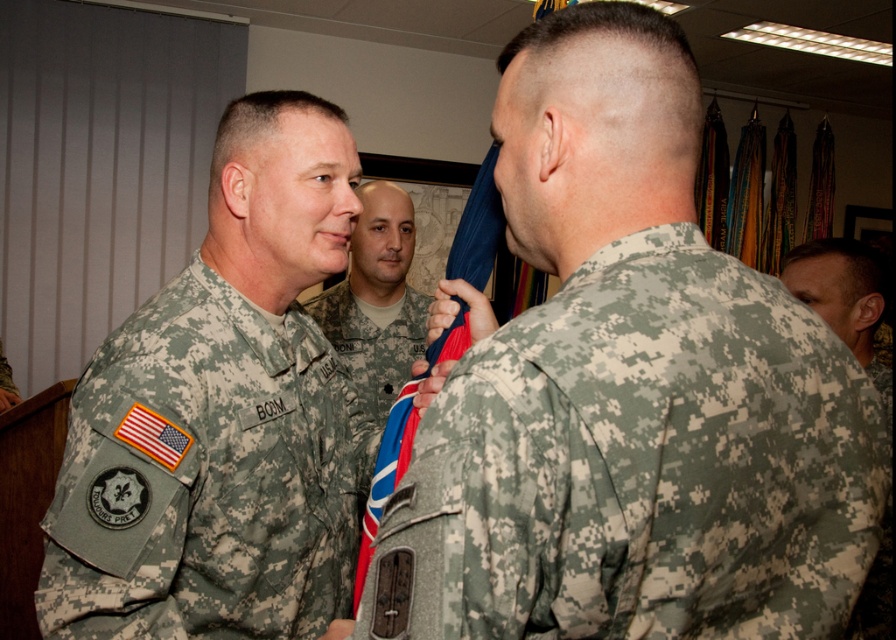
You are observing a military ceremony and notice two soldiers in camouflage uniforms. Which soldier, the camouflage fabric uniform at left or the camouflage uniform at center, is standing more to the left side?

The camouflage fabric uniform at left is positioned on the left side of the camouflage uniform at center, so the camouflage fabric uniform at left is standing more to the left side.

You are observing a military ceremony and notice two soldiers wearing camouflage uniforms. The soldier in the camouflage fabric uniform at left and the soldier in the camouflage uniform at center. Based on their positions, which soldier appears shorter?

The camouflage fabric uniform at left is not as tall as the camouflage uniform at center, so the soldier in the camouflage fabric uniform at left appears shorter.

You are a photographer positioned at the camera. You observe two points in the scene labeled as point (631, 236) and point (199, 461). Which point is nearer to your current position?

Point (631, 236) is closer to the camera than point (199, 461).